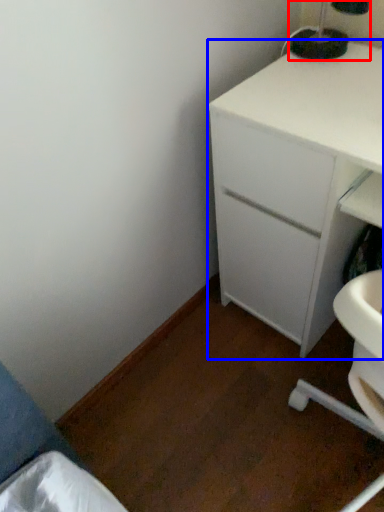
Question: Which of the following is the closest to the observer, bedside lamp (highlighted by a red box) or chest of drawers (highlighted by a blue box)?

Choices:
 (A) bedside lamp
 (B) chest of drawers

Answer: (B)